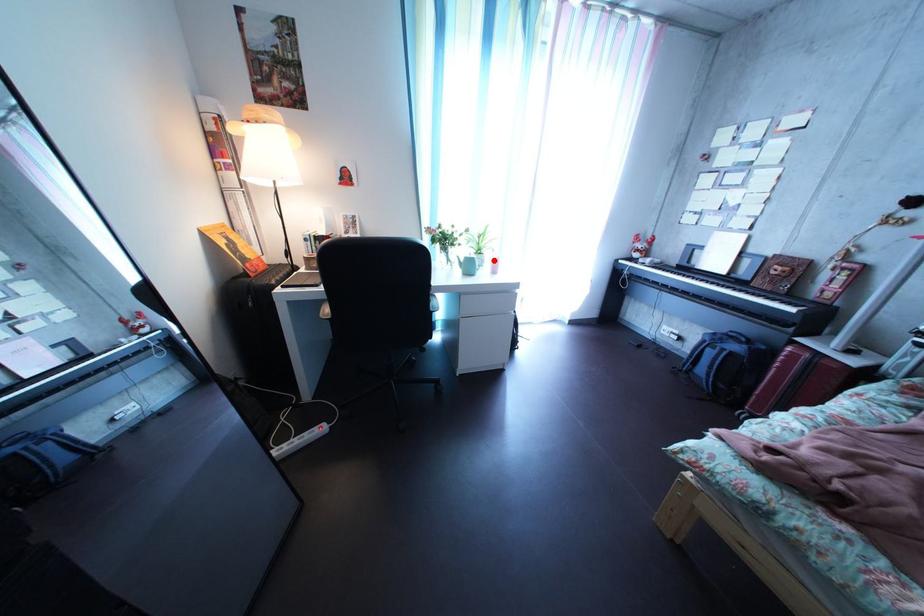
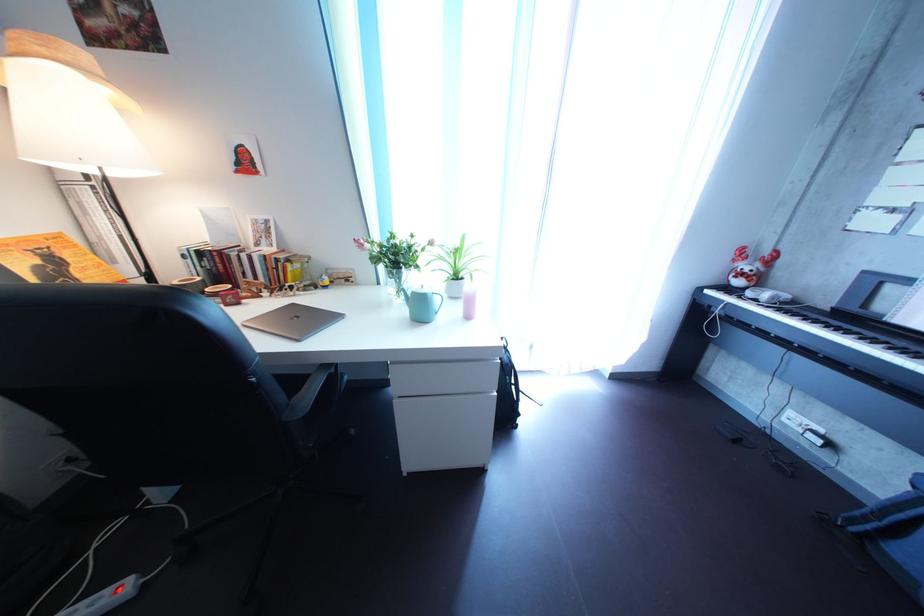
Question: I am providing you with two images of the same scene from different viewpoints. Image1 has a red point marked. In image2, the corresponding 3D location appears at what relative position? Reply with the corresponding letter.

Choices:
 (A) Closer
 (B) Farther

Answer: (B)